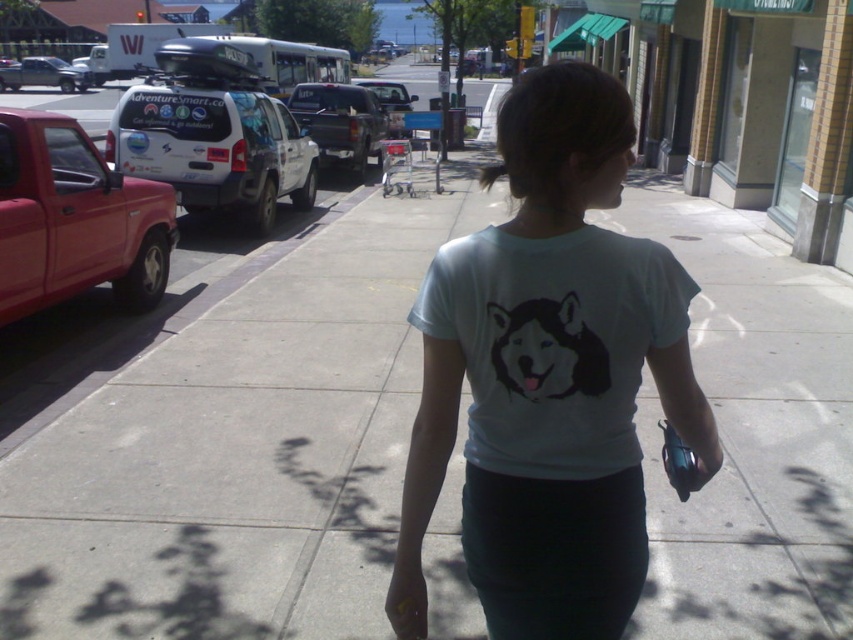
You are standing on the sidewalk and see a person walking away from you wearing a light blue T shirt with a graphic of a husky dog on the back. The person is holding a small object in their right hand. You notice a point at coordinates (553, 342). What is located at that point?

The light blue cotton t shirt at center is located at point (553, 342).